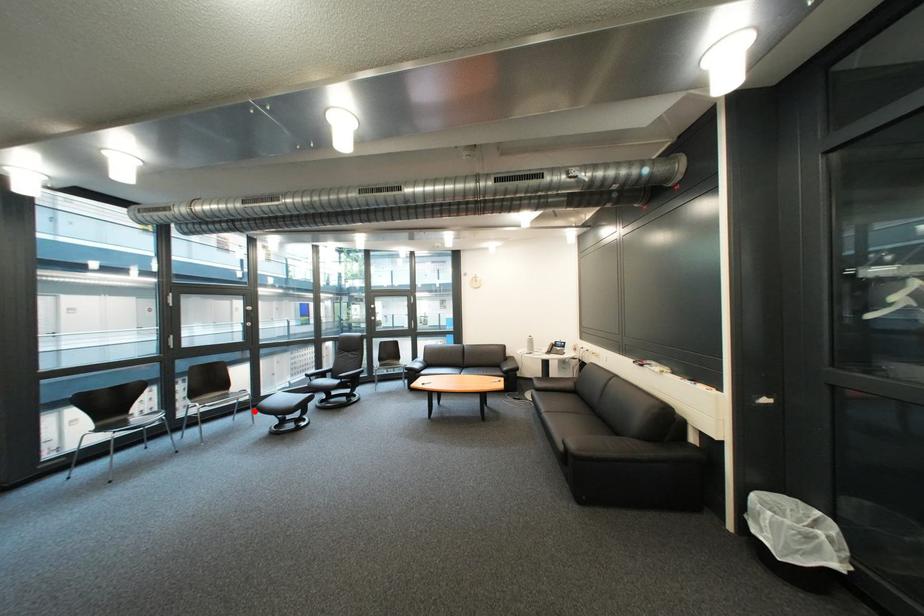
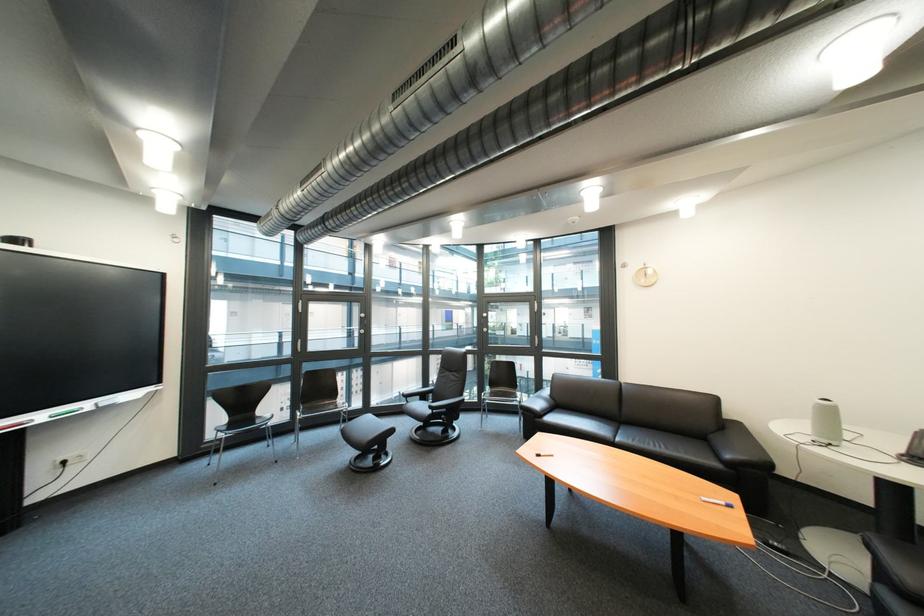
Find the pixel in the second image that matches the highlighted location in the first image.

(359, 424)